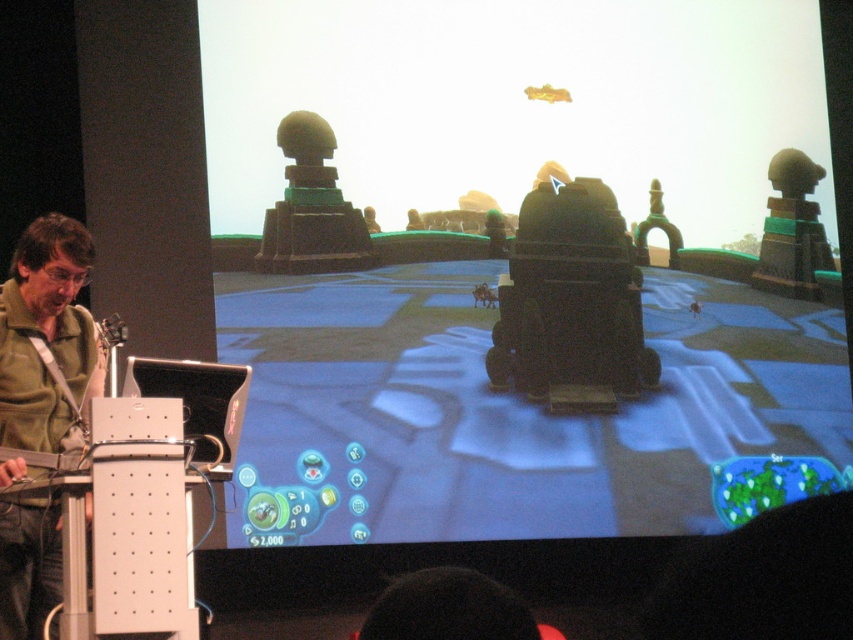
You are a stagehand setting up for a presentation. The presenter needs to adjust their position so that they are exactly halfway between the matte black projector screen at center and the green matte shirt at left. Where should they stand?

The presenter should stand 3.79 feet away from both the matte black projector screen at center and the green matte shirt at left, as the halfway point between them is 3.79 feet from each object.

Looking at this image, you are an attendee at a gaming convention and want to take a photo of the presenter and the projected game screen. The presenter is standing at point [492,339] and the game screen is at point [33,230]. Which point should you focus on first to ensure both are in focus?

You should focus on point [492,339] first because it is closer to you than point [33,230], ensuring both the presenter and the game screen are in focus.

You are an event organizer setting up a presentation. You need to ensure that the matte black projector screen at center is visible to all attendees. Considering the height difference between it and the green matte shirt at left, which object should you adjust to improve visibility?

The matte black projector screen at center is much taller than the green matte shirt at left. To improve visibility, you should adjust the height of the green matte shirt at left so it doesn